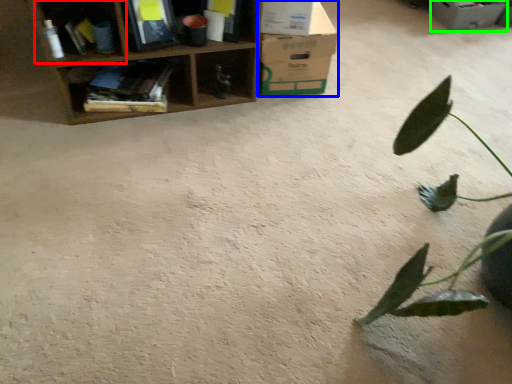
Question: Which is farther away from shelf (highlighted by a red box)? cardboard box (highlighted by a blue box) or cardboard box (highlighted by a green box)?

Choices:
 (A) cardboard box
 (B) cardboard box

Answer: (B)